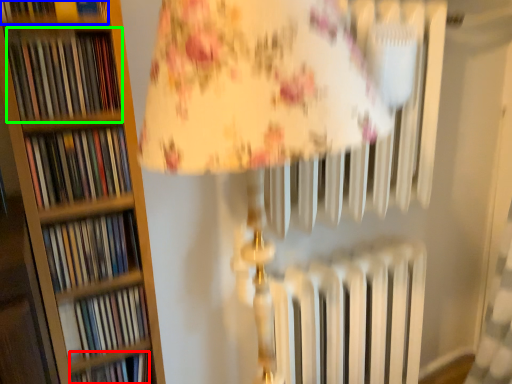
Question: Based on their relative distances, which object is farther from book (highlighted by a red box)? Choose from book (highlighted by a blue box) and book (highlighted by a green box).

Choices:
 (A) book
 (B) book

Answer: (A)